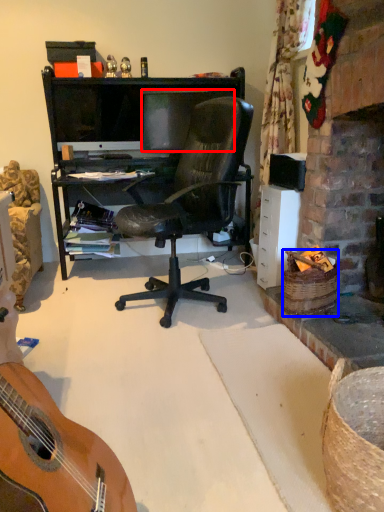
Question: Among these objects, which one is farthest to the camera, television (highlighted by a red box) or picnic basket (highlighted by a blue box)?

Choices:
 (A) television
 (B) picnic basket

Answer: (A)